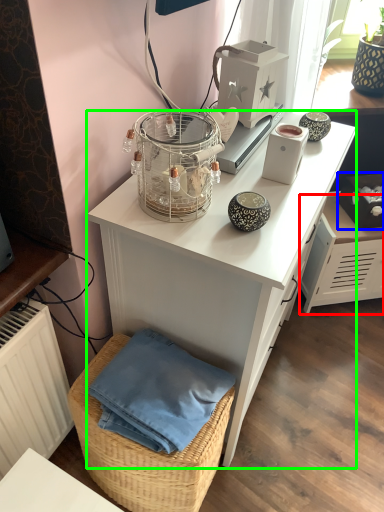
Question: Which is nearer to the file cabinet (highlighted by a red box)? box (highlighted by a blue box) or desk (highlighted by a green box).

Choices:
 (A) box
 (B) desk

Answer: (A)